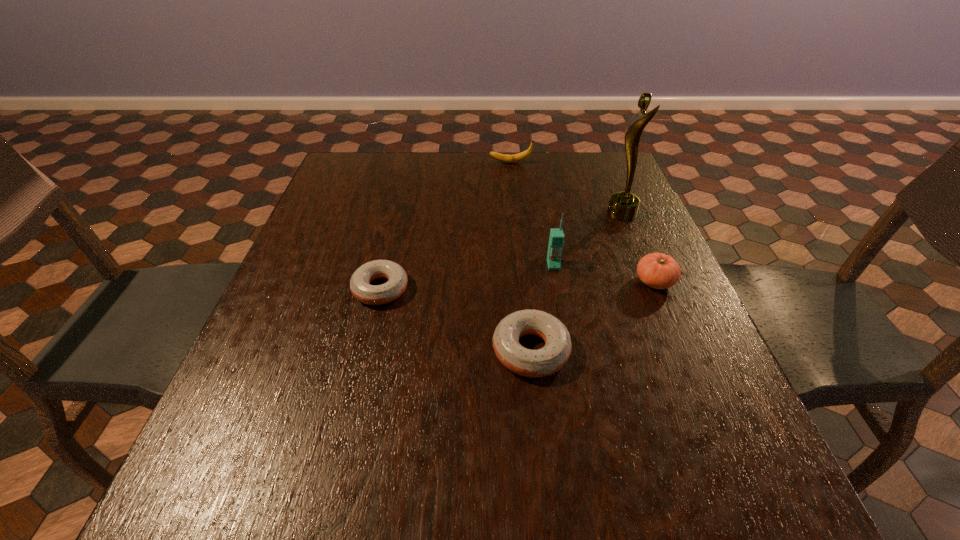
Observe the arrangement of all doughnuts in the image. To keep them evenly spaced, where would you place another doughnut on the right? Please locate a free space. Please provide its 2D coordinates. Your answer should be formatted as a tuple, i.e. [(x, y)], where the tuple contains the x and y coordinates of a point satisfying the conditions above.

[(732, 433)]